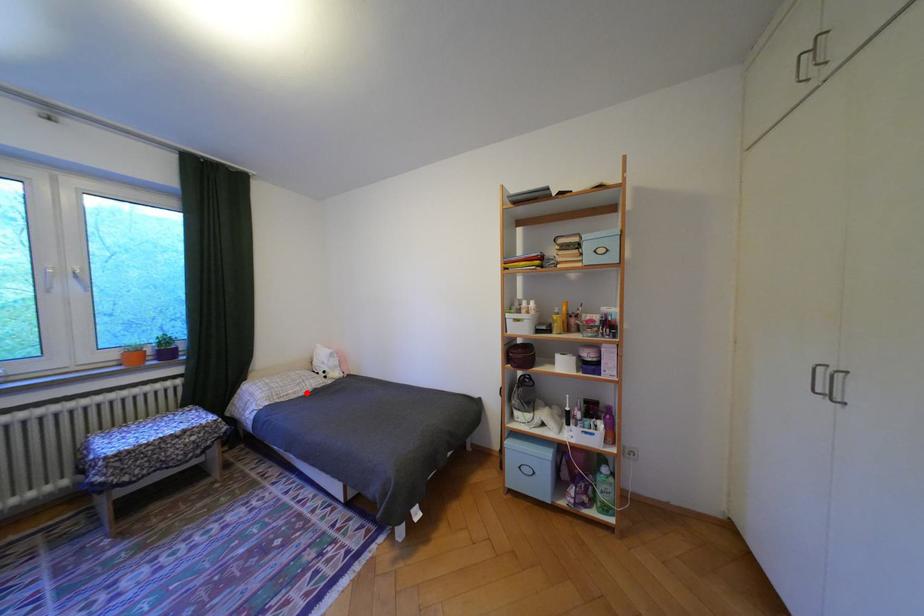
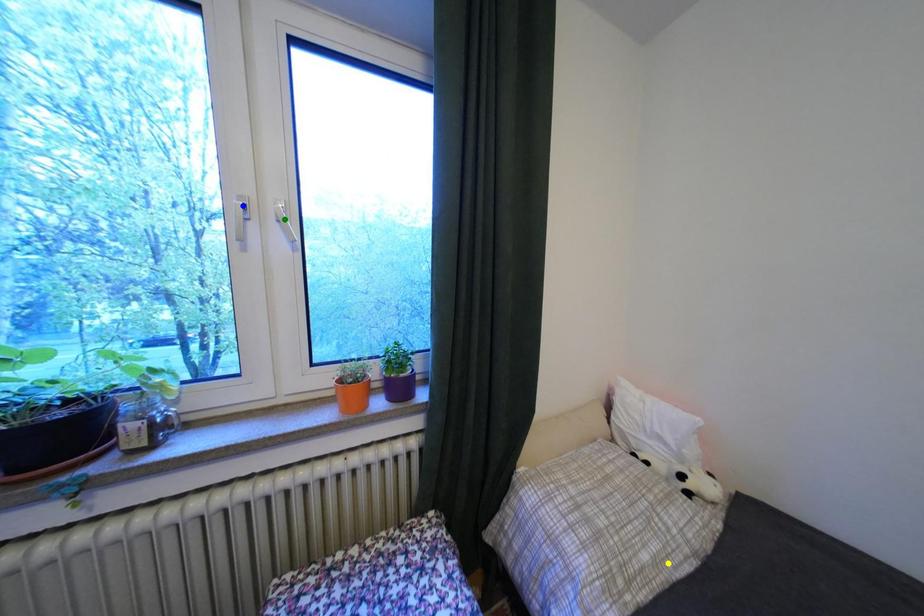
Question: I am providing you with two images of the same scene from different viewpoints. A red point is marked on the first image. You are given multiple points on the second image. Can you choose the point in image 2 that corresponds to the point in image 1?

Choices:
 (A) green point
 (B) blue point
 (C) yellow point

Answer: (C)